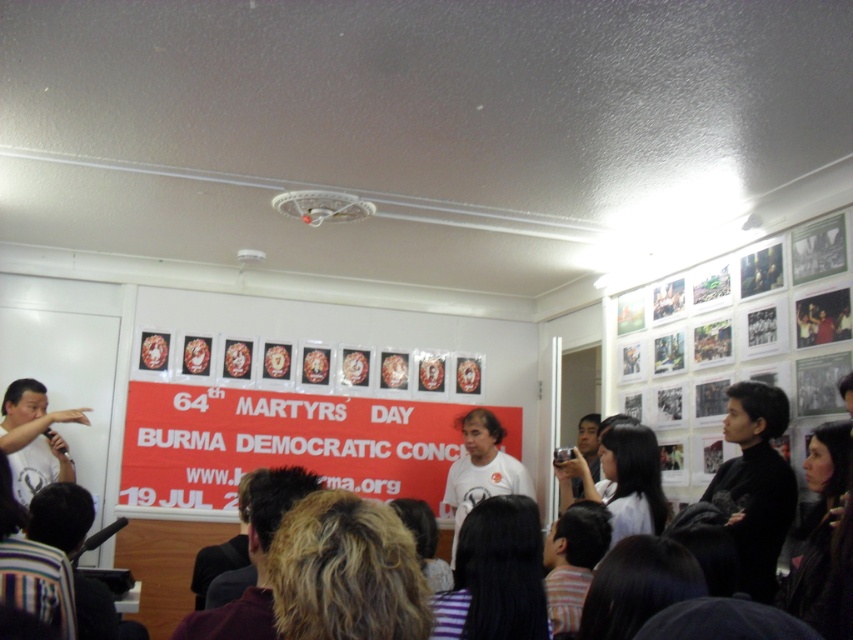
Question: Which object is closer to the camera taking this photo?

Choices:
 (A) dark hair at center
 (B) white matte t-shirt at center

Answer: (A)

Question: Is dark hair at center to the left of matte white t-shirt at left from the viewer's perspective?

Choices:
 (A) yes
 (B) no

Answer: (B)

Question: Can you confirm if dark hair at center is thinner than white matte t-shirt at center?

Choices:
 (A) no
 (B) yes

Answer: (A)

Question: Considering the relative positions of dark hair at center and matte white t-shirt at left in the image provided, where is dark hair at center located with respect to matte white t-shirt at left?

Choices:
 (A) right
 (B) left

Answer: (A)

Question: Which point is farther to the camera?

Choices:
 (A) (485, 445)
 (B) (142, 579)
 (C) (38, 451)

Answer: (B)

Question: Which point is closer to the camera taking this photo?

Choices:
 (A) (45, 433)
 (B) (486, 433)

Answer: (A)